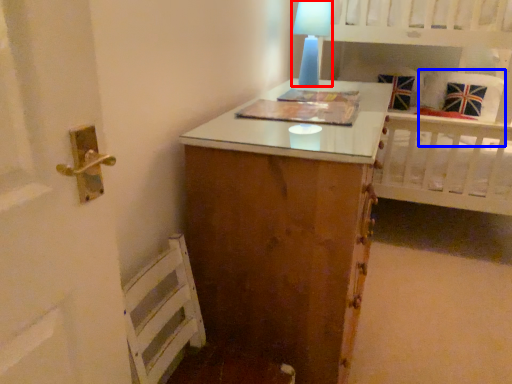
Question: Which object appears farthest to the camera in this image, table lamp (highlighted by a red box) or pillow (highlighted by a blue box)?

Choices:
 (A) table lamp
 (B) pillow

Answer: (B)